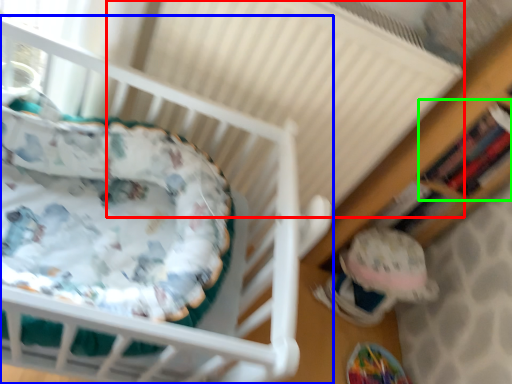
Question: Which is nearer to the radiator (highlighted by a red box)? infant bed (highlighted by a blue box) or shelf (highlighted by a green box).

Choices:
 (A) infant bed
 (B) shelf

Answer: (A)